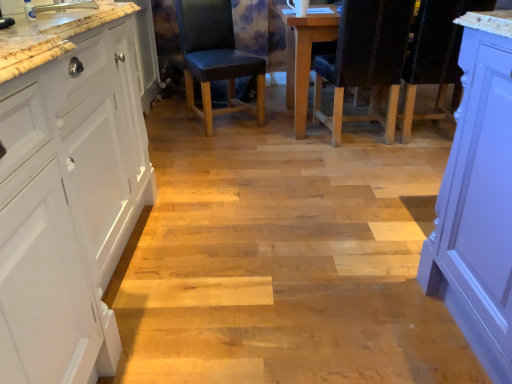
Question: Based on their sizes in the image, would you say leather-like black chair at center, arranged as the 1th chair when viewed from the left, is bigger or smaller than white matte cabinet at left?

Choices:
 (A) small
 (B) big

Answer: (A)

Question: From a real-world perspective, relative to white matte cabinet at left, is leather-like black chair at center, arranged as the 1th chair when viewed from the left, vertically above or below?

Choices:
 (A) below
 (B) above

Answer: (A)

Question: Estimate the real-world distances between objects in this image. Which object is farther from the black leather chair at center, arranged as the first chair when viewed from the right?

Choices:
 (A) leather-like black chair at center, arranged as the 1th chair when viewed from the left
 (B) white matte cabinet at left

Answer: (B)

Question: Considering the real-world distances, which object is closest to the white matte cabinet at left?

Choices:
 (A) leather-like black chair at center, which is the second chair in right-to-left order
 (B) black leather chair at center, arranged as the first chair when viewed from the right

Answer: (A)